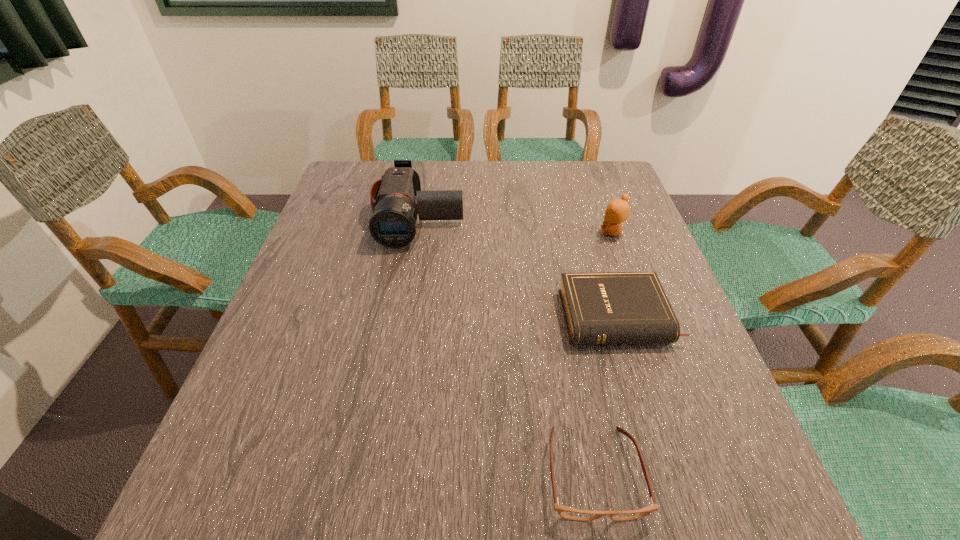
Find the location of a particular element. camcorder is located at coordinates (393, 224).

Find the location of `teddy bear`. teddy bear is located at coordinates (618, 210).

The width and height of the screenshot is (960, 540). I want to click on the second nearest object, so click(x=613, y=307).

Identify the location of spectacles. (566, 512).

Locate an element on the screen. This screenshot has height=540, width=960. the shortest object is located at coordinates (566, 512).

Find the location of a particular element. The width and height of the screenshot is (960, 540). vacant area situated 0.340m on the lens of the leftmost object is located at coordinates (394, 359).

The image size is (960, 540). I want to click on vacant space situated 0.120m on the face of the teddy bear, so click(555, 232).

Image resolution: width=960 pixels, height=540 pixels. I want to click on vacant space located 0.360m on the face of the teddy bear, so click(464, 232).

In order to click on free space located 0.220m on the face of the teddy bear in this screenshot , I will do `click(517, 232)`.

Where is `vacant space situated on the front of the third farthest object`? The height and width of the screenshot is (540, 960). vacant space situated on the front of the third farthest object is located at coordinates (640, 389).